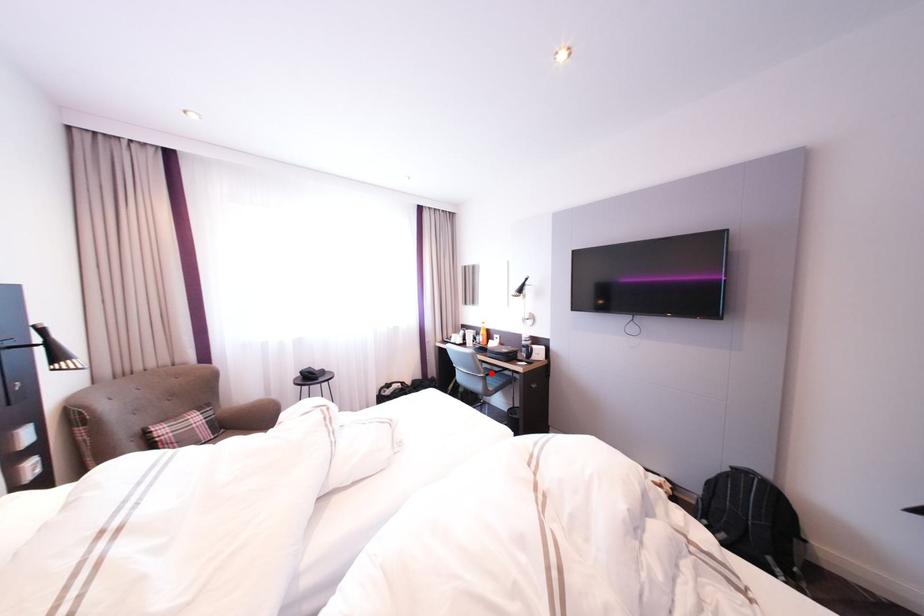
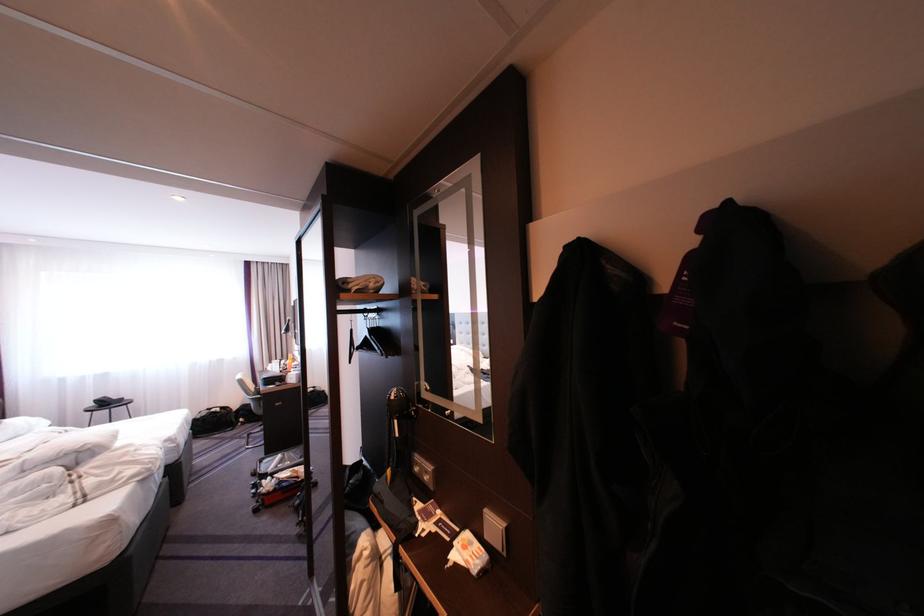
Question: I am providing you with two images of the same scene from different viewpoints. Given a red point in image1, look at the same physical point in image2. Is it:

Choices:
 (A) Closer to the viewpoint
 (B) Farther from the viewpoint

Answer: (B)